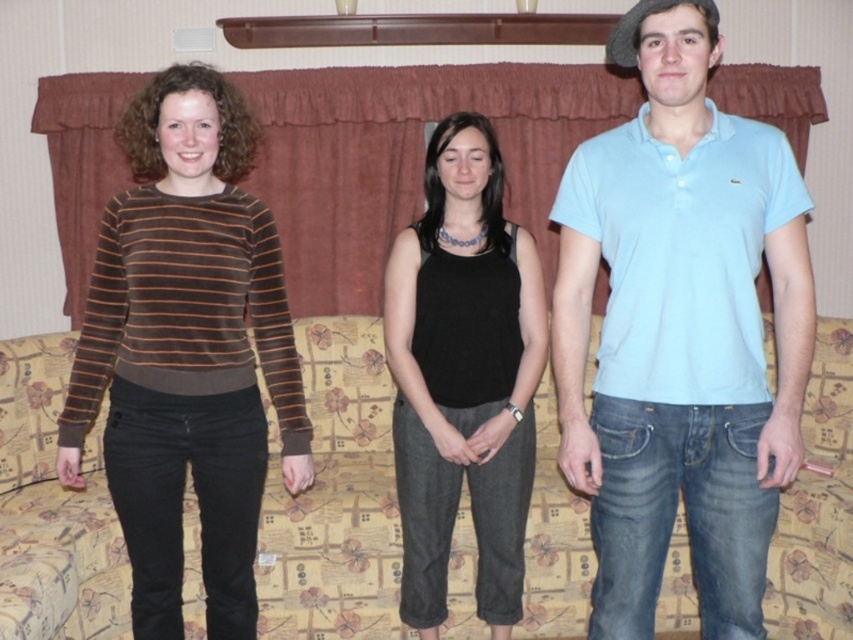
Is floral-patterned fabric couch at center closer to the viewer compared to black matte tank top at center?

Yes, it is in front of black matte tank top at center.

Between floral-patterned fabric couch at center and black matte tank top at center, which one appears on the right side from the viewer's perspective?

black matte tank top at center

Locate an element on the screen. floral-patterned fabric couch at center is located at coordinates (335, 499).

Who is positioned more to the right, light blue cotton polo shirt at right or black matte tank top at center?

Positioned to the right is light blue cotton polo shirt at right.

Is point (718, 342) in front of point (424, 435)?

Yes, point (718, 342) is closer to viewer.

The image size is (853, 640). I want to click on light blue cotton polo shirt at right, so click(680, 332).

Does point (292, 598) lie behind point (265, 464)?

That is True.

In the scene shown: Is floral-patterned fabric couch at center bigger than brown velvety sweater at left?

Yes, floral-patterned fabric couch at center is bigger than brown velvety sweater at left.

Is point (351, 627) less distant than point (117, 132)?

Yes, point (351, 627) is in front of point (117, 132).

Image resolution: width=853 pixels, height=640 pixels. I want to click on floral-patterned fabric couch at center, so click(x=335, y=499).